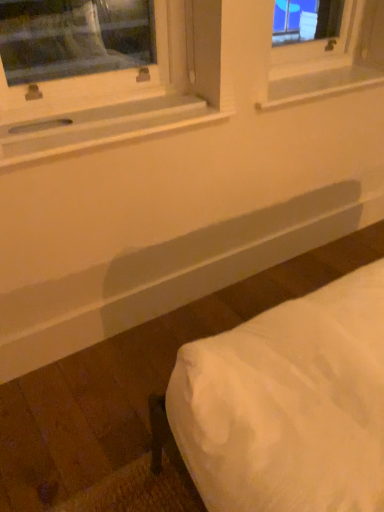
What do you see at coordinates (319, 85) in the screenshot? This screenshot has height=512, width=384. I see `white plastic window sill at upper center, placed as the 2th window sill when sorted from front to back` at bounding box center [319, 85].

What are the coordinates of `white wood window sill at upper left, acting as the second window sill starting from the back` in the screenshot? It's located at (102, 128).

How far apart are white plastic window sill at upper center, placed as the 2th window sill when sorted from front to back, and white wood window sill at upper left, the 1th window sill in the left-to-right sequence?

white plastic window sill at upper center, placed as the 2th window sill when sorted from front to back, and white wood window sill at upper left, the 1th window sill in the left-to-right sequence, are 52.31 centimeters apart from each other.

Which object is further away from the camera, white plastic window sill at upper center, placed as the first window sill when sorted from back to front, or white wood window sill at upper left, which ranks as the 1th window sill in front-to-back order?

white plastic window sill at upper center, placed as the first window sill when sorted from back to front, is behind.

Can white wood window sill at upper left, acting as the second window sill starting from the back, be found inside white plastic window sill at upper center, placed as the 2th window sill when sorted from front to back?

No.

Is white plastic window sill at upper center, which ranks as the 1th window sill in right-to-left order, placed right next to white wood window sill at upper left, positioned as the second window sill in right-to-left order?

white plastic window sill at upper center, which ranks as the 1th window sill in right-to-left order, is not next to white wood window sill at upper left, positioned as the second window sill in right-to-left order, and they're not touching.

Is white fabric bed at lower right beside white wood window sill at upper left, positioned as the second window sill in right-to-left order?

No.

Between white fabric bed at lower right and white wood window sill at upper left, which ranks as the 1th window sill in front-to-back order, which one has larger size?

Bigger between the two is white fabric bed at lower right.

Is white fabric bed at lower right to the right of white wood window sill at upper left, the 1th window sill in the left-to-right sequence, from the viewer's perspective?

Yes, white fabric bed at lower right is to the right of white wood window sill at upper left, the 1th window sill in the left-to-right sequence.

Is white fabric bed at lower right turned away from white wood window sill at upper left, acting as the second window sill starting from the back?

white fabric bed at lower right is not turned away from white wood window sill at upper left, acting as the second window sill starting from the back.

Between white wood window sill at upper left, positioned as the second window sill in right-to-left order, and white plastic window sill at upper center, positioned as the second window sill in left-to-right order, which one has smaller size?

Smaller between the two is white plastic window sill at upper center, positioned as the second window sill in left-to-right order.

Locate an element on the screen. The height and width of the screenshot is (512, 384). window sill below the white wood window sill at upper left, which ranks as the 1th window sill in front-to-back order (from a real-world perspective) is located at coordinates (319, 85).

Is white wood window sill at upper left, which ranks as the 1th window sill in front-to-back order, oriented towards white plastic window sill at upper center, positioned as the second window sill in left-to-right order?

No.

In the scene shown: From a real-world perspective, is white wood window sill at upper left, acting as the second window sill starting from the back, positioned over white plastic window sill at upper center, which ranks as the 1th window sill in right-to-left order, based on gravity?

Yes, from a real-world perspective, white wood window sill at upper left, acting as the second window sill starting from the back, is over white plastic window sill at upper center, which ranks as the 1th window sill in right-to-left order

Which object is more forward, white fabric bed at lower right or white plastic window sill at upper center, which ranks as the 1th window sill in right-to-left order?

white fabric bed at lower right.

From the image's perspective, is white fabric bed at lower right above or below white plastic window sill at upper center, placed as the first window sill when sorted from back to front?

Clearly, from the image's perspective, white fabric bed at lower right is below white plastic window sill at upper center, placed as the first window sill when sorted from back to front.

Is white fabric bed at lower right positioned beyond the bounds of white plastic window sill at upper center, placed as the first window sill when sorted from back to front?

white fabric bed at lower right lies outside white plastic window sill at upper center, placed as the first window sill when sorted from back to front,'s area.

Considering the relative sizes of white fabric bed at lower right and white plastic window sill at upper center, positioned as the second window sill in left-to-right order, in the image provided, is white fabric bed at lower right thinner than white plastic window sill at upper center, positioned as the second window sill in left-to-right order,?

No.

From the image's perspective, is white plastic window sill at upper center, which ranks as the 1th window sill in right-to-left order, positioned above or below white fabric bed at lower right?

Clearly, from the image's perspective, white plastic window sill at upper center, which ranks as the 1th window sill in right-to-left order, is above white fabric bed at lower right.

Is white plastic window sill at upper center, positioned as the second window sill in left-to-right order, closer to camera compared to white fabric bed at lower right?

No, white plastic window sill at upper center, positioned as the second window sill in left-to-right order, is further to the viewer.

Does white plastic window sill at upper center, placed as the first window sill when sorted from back to front, have a greater width compared to white fabric bed at lower right?

In fact, white plastic window sill at upper center, placed as the first window sill when sorted from back to front, might be narrower than white fabric bed at lower right.

Does white plastic window sill at upper center, which ranks as the 1th window sill in right-to-left order, turn towards white fabric bed at lower right?

No.

From the image's perspective, which one is positioned higher, white wood window sill at upper left, the 1th window sill in the left-to-right sequence, or white fabric bed at lower right?

white wood window sill at upper left, the 1th window sill in the left-to-right sequence.

Is point (75, 143) positioned behind point (202, 434)?

Yes, it is.

Is white wood window sill at upper left, positioned as the second window sill in right-to-left order, wider than white fabric bed at lower right?

No, white wood window sill at upper left, positioned as the second window sill in right-to-left order, is not wider than white fabric bed at lower right.

Does white wood window sill at upper left, acting as the second window sill starting from the back, have a lesser height compared to white fabric bed at lower right?

Correct, white wood window sill at upper left, acting as the second window sill starting from the back, is not as tall as white fabric bed at lower right.

Find the location of a particular element. This screenshot has width=384, height=512. window sill lying above the white wood window sill at upper left, acting as the second window sill starting from the back (from the image's perspective) is located at coordinates (319, 85).

Identify the location of furniture that is in front of the white wood window sill at upper left, acting as the second window sill starting from the back. (288, 404).

Looking at the image, which one is located further to white fabric bed at lower right, white plastic window sill at upper center, placed as the first window sill when sorted from back to front, or white wood window sill at upper left, acting as the second window sill starting from the back?

white plastic window sill at upper center, placed as the first window sill when sorted from back to front.

Looking at this image, considering their positions, is white plastic window sill at upper center, placed as the first window sill when sorted from back to front, positioned further to white wood window sill at upper left, acting as the second window sill starting from the back, than white fabric bed at lower right?

Based on the image, white fabric bed at lower right appears to be further to white wood window sill at upper left, acting as the second window sill starting from the back.

Considering their positions, is white wood window sill at upper left, which ranks as the 1th window sill in front-to-back order, positioned closer to white plastic window sill at upper center, positioned as the second window sill in left-to-right order, than white fabric bed at lower right?

white wood window sill at upper left, which ranks as the 1th window sill in front-to-back order, is closer to white plastic window sill at upper center, positioned as the second window sill in left-to-right order.

When comparing their distances from white wood window sill at upper left, positioned as the second window sill in right-to-left order, does white fabric bed at lower right or white plastic window sill at upper center, positioned as the second window sill in left-to-right order, seem closer?

Based on the image, white plastic window sill at upper center, positioned as the second window sill in left-to-right order, appears to be nearer to white wood window sill at upper left, positioned as the second window sill in right-to-left order.

Based on their spatial positions, is white wood window sill at upper left, which ranks as the 1th window sill in front-to-back order, or white plastic window sill at upper center, placed as the 2th window sill when sorted from front to back, further from white fabric bed at lower right?

Among the two, white plastic window sill at upper center, placed as the 2th window sill when sorted from front to back, is located further to white fabric bed at lower right.

From the picture: Estimate the real-world distances between objects in this image. Which object is further from white plastic window sill at upper center, which ranks as the 1th window sill in right-to-left order, white fabric bed at lower right or white wood window sill at upper left, acting as the second window sill starting from the back?

Among the two, white fabric bed at lower right is located further to white plastic window sill at upper center, which ranks as the 1th window sill in right-to-left order.

Locate an element on the screen. The width and height of the screenshot is (384, 512). window sill between white plastic window sill at upper center, positioned as the second window sill in left-to-right order, and white fabric bed at lower right in the up-down direction is located at coordinates coord(102,128).